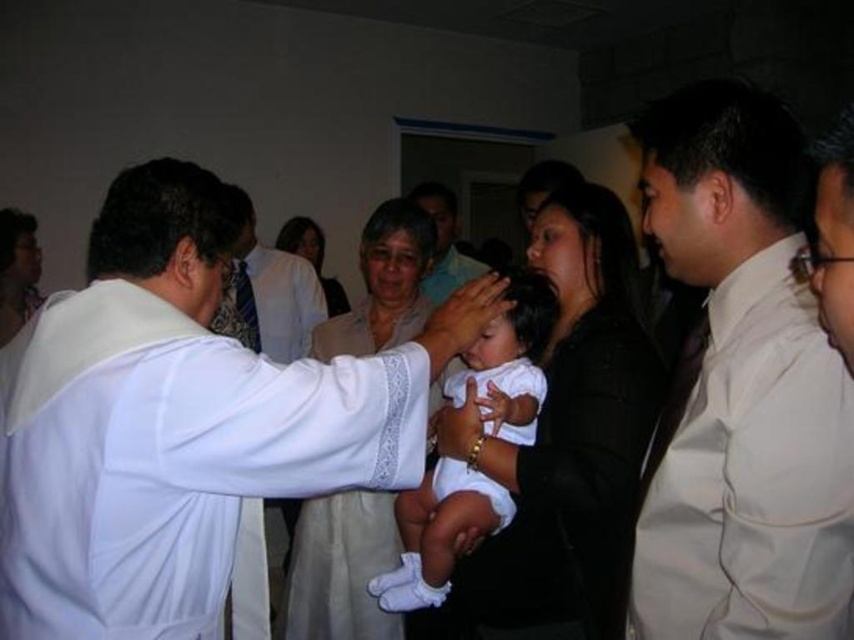
In the scene shown: Can you confirm if white clothed baby at center is positioned to the left of white satin robe at center?

Incorrect, white clothed baby at center is not on the left side of white satin robe at center.

Is point (527, 310) positioned behind point (290, 314)?

No, (527, 310) is in front of (290, 314).

Identify the location of white clothed baby at center. The width and height of the screenshot is (854, 640). (437, 532).

Which is more to the left, white smooth shirt at right or white lace dress at center?

From the viewer's perspective, white lace dress at center appears more on the left side.

This screenshot has width=854, height=640. Describe the element at coordinates (741, 388) in the screenshot. I see `white smooth shirt at right` at that location.

This screenshot has width=854, height=640. Identify the location of white smooth shirt at right. (741, 388).

Between black matte suit at center and smooth white shirt at center, which one has more height?

black matte suit at center

Identify the location of black matte suit at center. This screenshot has height=640, width=854. (566, 442).